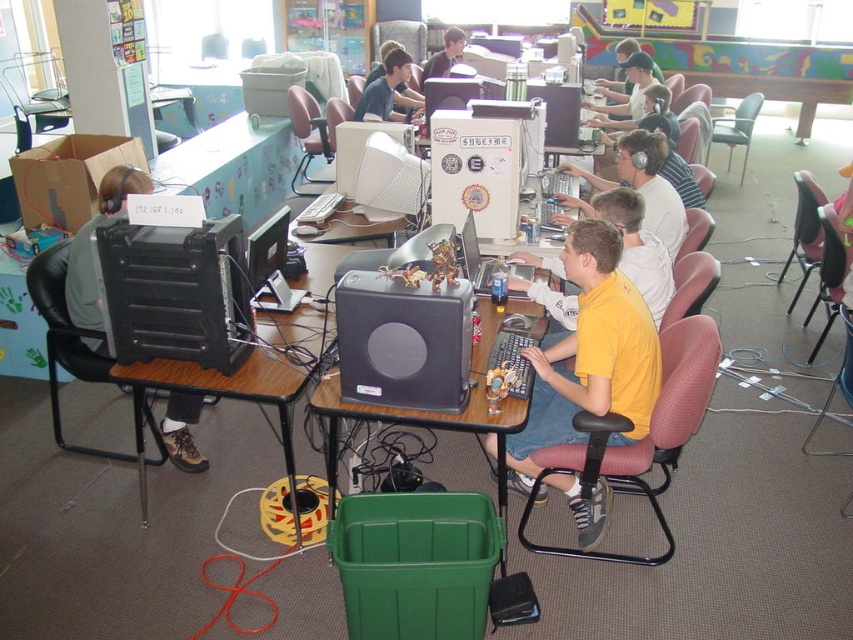
Question: Observing the image, what is the correct spatial positioning of black plastic desktop at left in reference to matte black computer at left?

Choices:
 (A) below
 (B) above

Answer: (A)

Question: Is black plastic desktop at left above matte black laptop at center?

Choices:
 (A) no
 (B) yes

Answer: (A)

Question: Which point is farther from the camera taking this photo?

Choices:
 (A) (190, 454)
 (B) (392, 72)
 (C) (503, 260)

Answer: (B)

Question: Which of the following is the farthest from the observer?

Choices:
 (A) shiny silver laptop at center
 (B) matte black laptop at upper center
 (C) black plastic desktop at left

Answer: (B)

Question: Is yellow matte shirt at center bigger than matte black laptop at center?

Choices:
 (A) yes
 (B) no

Answer: (A)

Question: Which object is positioned closest to the matte black computer at left?

Choices:
 (A) yellow matte shirt at center
 (B) matte black monitor at center
 (C) shiny silver laptop at center
 (D) matte black laptop at upper center

Answer: (B)